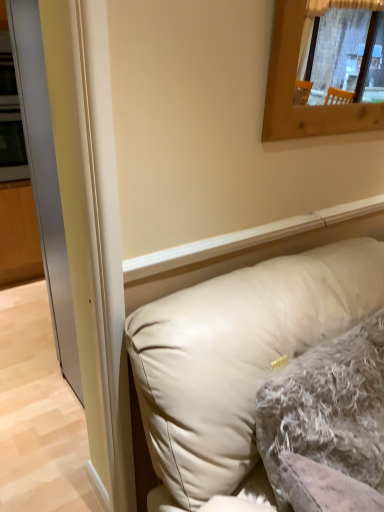
Question: Is beige leather pillow at lower right, the second pillow in the back-to-front sequence, located within fuzzy gray pillow at center, the 2th pillow positioned from the front?

Choices:
 (A) no
 (B) yes

Answer: (A)

Question: From the image's perspective, is fuzzy gray pillow at center, the first pillow in the back-to-front sequence, on top of beige leather pillow at lower right, the second pillow in the back-to-front sequence?

Choices:
 (A) no
 (B) yes

Answer: (B)

Question: Does fuzzy gray pillow at center, the 2th pillow positioned from the front, have a lesser width compared to beige leather pillow at lower right, positioned as the 1th pillow in front-to-back order?

Choices:
 (A) yes
 (B) no

Answer: (A)

Question: From the image's perspective, does fuzzy gray pillow at center, the 2th pillow positioned from the front, appear lower than beige leather pillow at lower right, the second pillow in the back-to-front sequence?

Choices:
 (A) no
 (B) yes

Answer: (A)

Question: Considering the relative sizes of fuzzy gray pillow at center, the 2th pillow positioned from the front, and beige leather pillow at lower right, positioned as the 1th pillow in front-to-back order, in the image provided, is fuzzy gray pillow at center, the 2th pillow positioned from the front, wider than beige leather pillow at lower right, positioned as the 1th pillow in front-to-back order,?

Choices:
 (A) no
 (B) yes

Answer: (A)

Question: Can you confirm if fuzzy gray pillow at center, the 2th pillow positioned from the front, is smaller than beige leather pillow at lower right, the second pillow in the back-to-front sequence?

Choices:
 (A) no
 (B) yes

Answer: (B)

Question: Is beige leather pillow at lower right, positioned as the 1th pillow in front-to-back order, thinner than fuzzy gray pillow at center, the first pillow in the back-to-front sequence?

Choices:
 (A) yes
 (B) no

Answer: (B)

Question: Does beige leather pillow at lower right, the second pillow in the back-to-front sequence, have a greater height compared to fuzzy gray pillow at center, the first pillow in the back-to-front sequence?

Choices:
 (A) no
 (B) yes

Answer: (B)

Question: Is beige leather pillow at lower right, positioned as the 1th pillow in front-to-back order, next to fuzzy gray pillow at center, the 2th pillow positioned from the front?

Choices:
 (A) no
 (B) yes

Answer: (A)

Question: Does beige leather pillow at lower right, positioned as the 1th pillow in front-to-back order, have a lesser height compared to fuzzy gray pillow at center, the first pillow in the back-to-front sequence?

Choices:
 (A) no
 (B) yes

Answer: (A)

Question: From a real-world perspective, is beige leather pillow at lower right, positioned as the 1th pillow in front-to-back order, beneath fuzzy gray pillow at center, the 2th pillow positioned from the front?

Choices:
 (A) yes
 (B) no

Answer: (A)

Question: Can you confirm if beige leather pillow at lower right, positioned as the 1th pillow in front-to-back order, is wider than fuzzy gray pillow at center, the first pillow in the back-to-front sequence?

Choices:
 (A) yes
 (B) no

Answer: (A)

Question: From a real-world perspective, is beige leather pillow at lower right, positioned as the 1th pillow in front-to-back order, under transparent glass door at left?

Choices:
 (A) no
 (B) yes

Answer: (B)